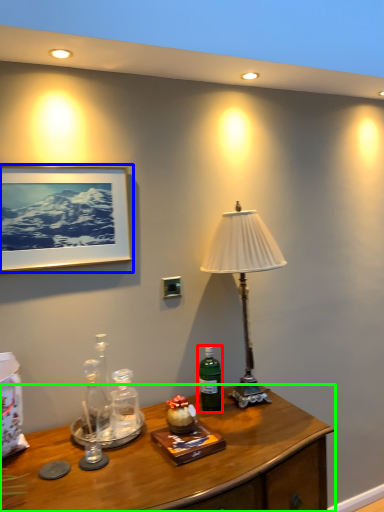
Question: Which is farther away from bottle (highlighted by a red box)? picture frame (highlighted by a blue box) or desk (highlighted by a green box)?

Choices:
 (A) picture frame
 (B) desk

Answer: (A)